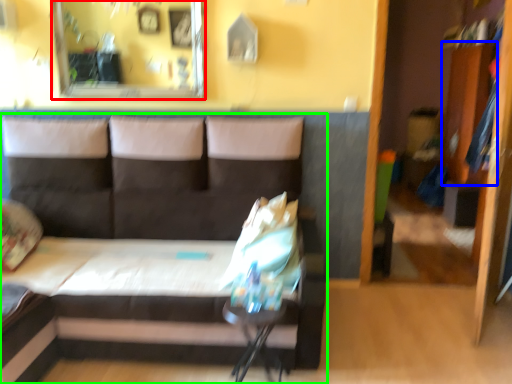
Question: Which object is positioned closest to mirror (highlighted by a red box)? Select from dresser (highlighted by a blue box) and studio couch (highlighted by a green box).

Choices:
 (A) dresser
 (B) studio couch

Answer: (B)